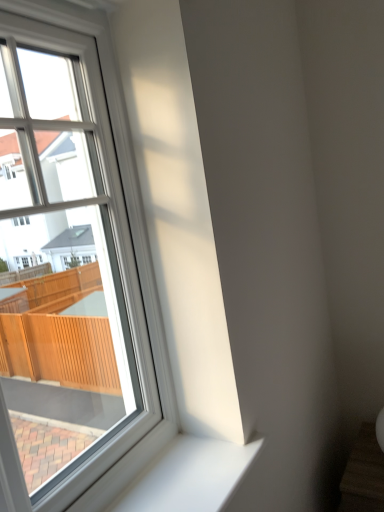
Image resolution: width=384 pixels, height=512 pixels. I want to click on blank space situated above white smooth window sill at lower left (from a real-world perspective), so click(x=197, y=472).